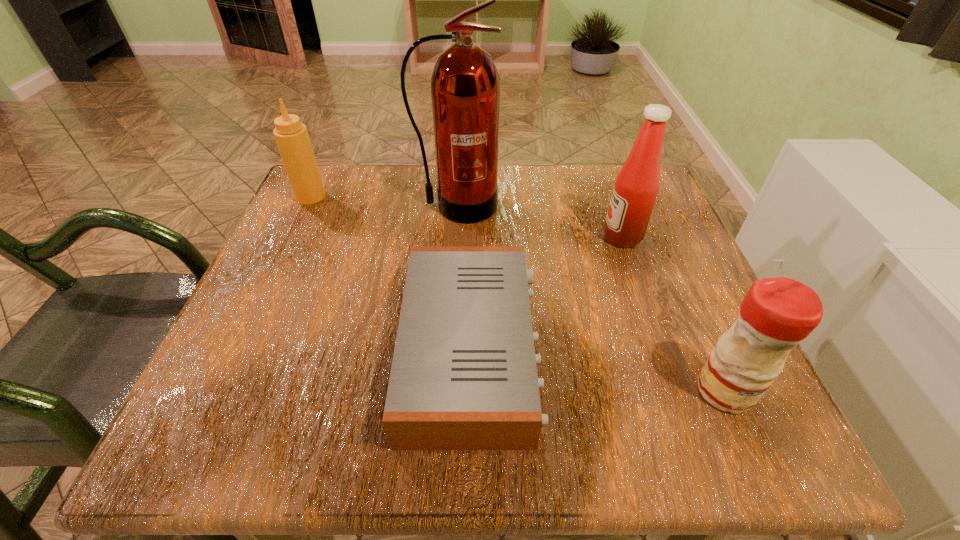
Locate an element on the screen. Image resolution: width=960 pixels, height=540 pixels. the tallest object is located at coordinates (x=465, y=87).

The width and height of the screenshot is (960, 540). I want to click on the third farthest object, so 636,187.

The height and width of the screenshot is (540, 960). Identify the location of the tallest condiment. (636, 187).

Identify the location of the leftmost condiment. This screenshot has height=540, width=960. (291, 136).

Find the location of `the leftmost object`. the leftmost object is located at coordinates (291, 136).

Find the location of `the nearest condiment`. the nearest condiment is located at coordinates (776, 314).

Identify the location of radio receiver. (464, 377).

Where is `free region located 0.190m on the front-facing side of the tallest object`? The width and height of the screenshot is (960, 540). free region located 0.190m on the front-facing side of the tallest object is located at coordinates 451,288.

The width and height of the screenshot is (960, 540). I want to click on vacant region located on the front-facing side of the second farthest condiment, so click(449, 237).

The width and height of the screenshot is (960, 540). I want to click on free point located 0.240m on the front-facing side of the second farthest condiment, so click(x=488, y=237).